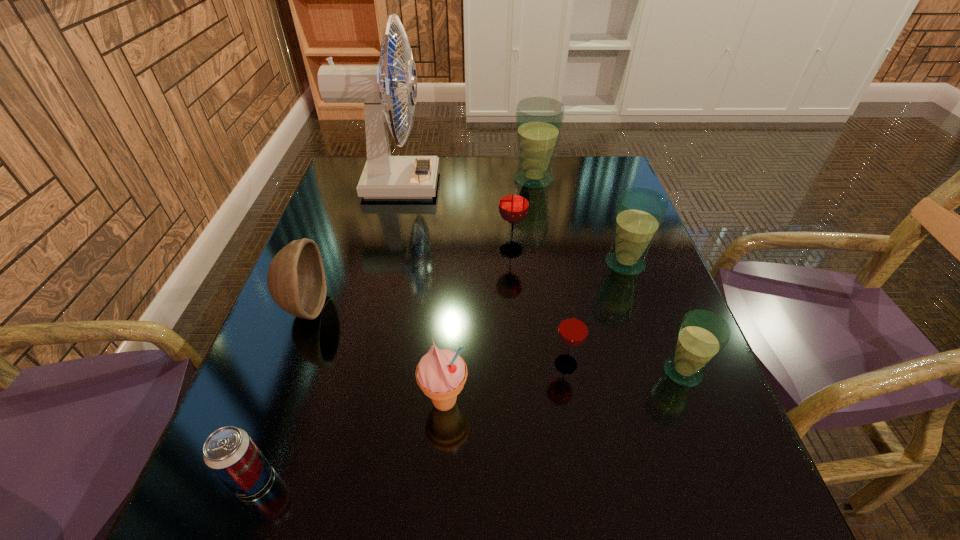
Choose which blue glass is the second nearest neighbor to the tallest object. Please provide its 2D coordinates. Your answer should be formatted as a tuple, i.e. [(x, y)], where the tuple contains the x and y coordinates of a point satisfying the conditions above.

[(640, 212)]

Select which blue glass is the third closest to the bigger red glass. Please provide its 2D coordinates. Your answer should be formatted as a tuple, i.e. [(x, y)], where the tuple contains the x and y coordinates of a point satisfying the conditions above.

[(702, 334)]

The height and width of the screenshot is (540, 960). In order to click on free spot that satisfies the following two spatial constraints: 1. on the front side of the nearest blue glass; 2. on the left side of the second farthest blue glass in this screenshot , I will do `click(663, 372)`.

At what (x,y) coordinates should I click in order to perform the action: click on vacant space that satisfies the following two spatial constraints: 1. on the front-facing side of the fan; 2. on the back side of the right red glass. Please return your answer as a coordinate pair (x, y). Looking at the image, I should click on (346, 364).

Where is `free space that satisfies the following two spatial constraints: 1. on the front-facing side of the farther red glass; 2. on the right side of the fan`? This screenshot has width=960, height=540. free space that satisfies the following two spatial constraints: 1. on the front-facing side of the farther red glass; 2. on the right side of the fan is located at coordinates (x=375, y=250).

Find the location of a particular element. The width and height of the screenshot is (960, 540). free space that satisfies the following two spatial constraints: 1. on the front side of the bowl; 2. on the left side of the beer can is located at coordinates (239, 480).